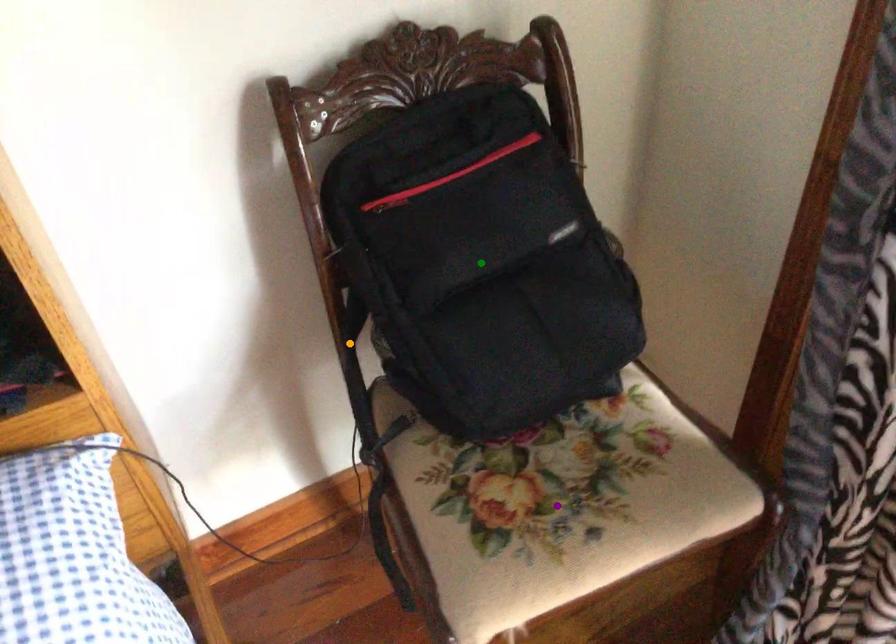
Order these from nearest to farthest:
- purple point
- green point
- orange point

purple point → green point → orange point